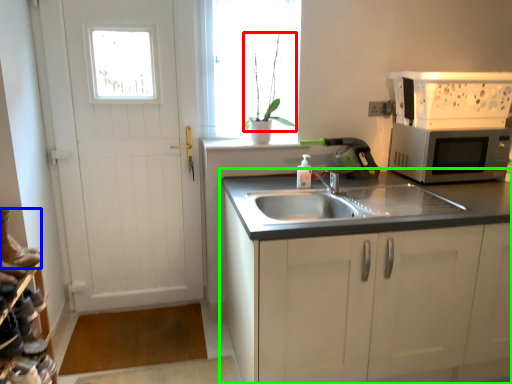
Question: Which object is positioned closest to plant (highlighted by a red box)? Select from running shoe (highlighted by a blue box) and cabinetry (highlighted by a green box).

Choices:
 (A) running shoe
 (B) cabinetry

Answer: (B)